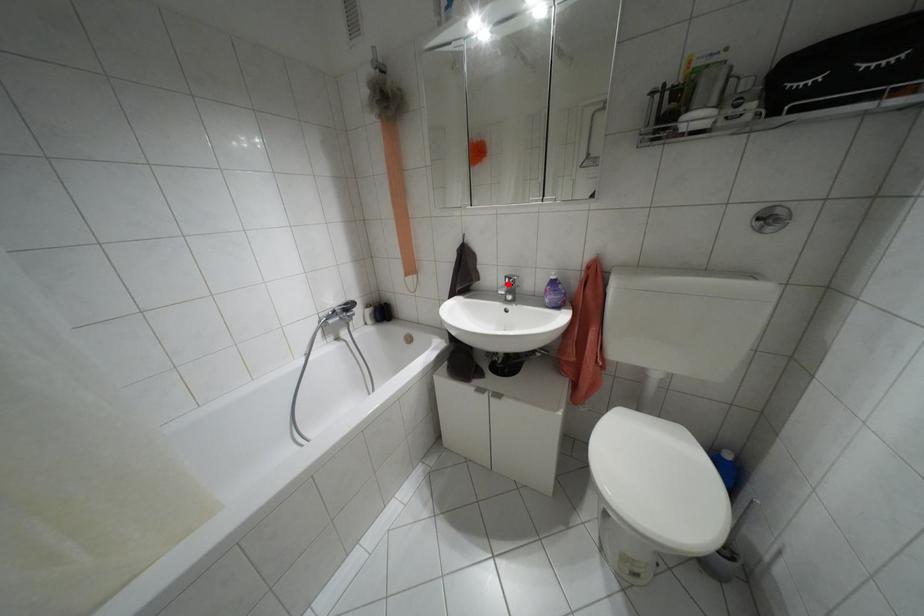
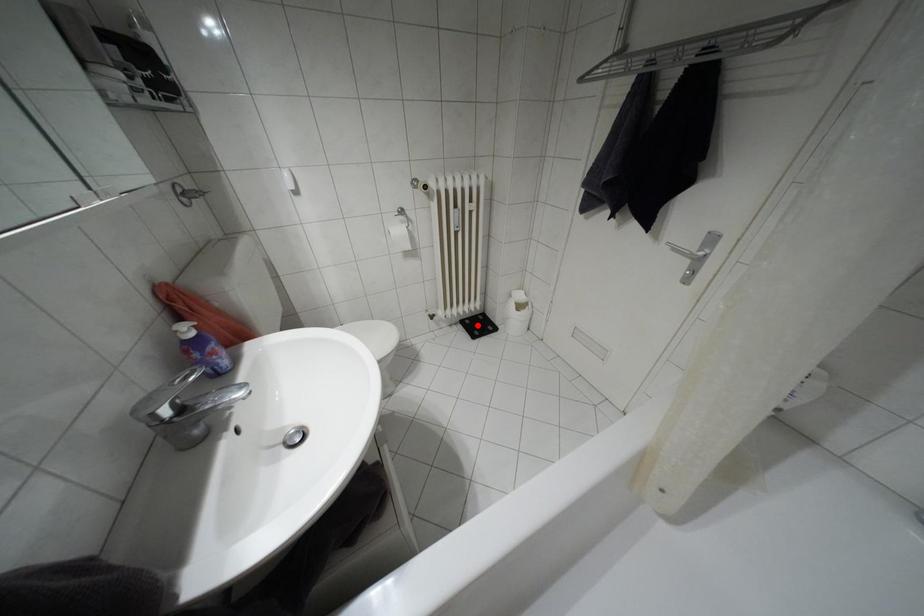
From the picture: I am providing you with two images of the same scene from different viewpoints. A red point is marked on the first image and another point is marked on the second image. Is the marked point in image1 the same physical position as the marked point in image2?

No